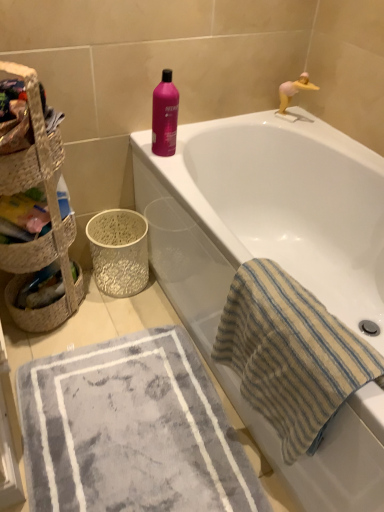
Question: Is white textured basket at lower left, the 2th basket container in the top-to-bottom sequence, facing towards gray plush bath mat at lower left?

Choices:
 (A) yes
 (B) no

Answer: (A)

Question: Considering the relative positions of white textured basket at lower left, acting as the second basket container starting from the front, and gray plush bath mat at lower left in the image provided, is white textured basket at lower left, acting as the second basket container starting from the front, to the right of gray plush bath mat at lower left from the viewer's perspective?

Choices:
 (A) yes
 (B) no

Answer: (B)

Question: Can you confirm if white textured basket at lower left, which appears as the first basket container when ordered from the bottom, is thinner than gray plush bath mat at lower left?

Choices:
 (A) no
 (B) yes

Answer: (B)

Question: Does white textured basket at lower left, which appears as the first basket container when ordered from the bottom, appear on the left side of gray plush bath mat at lower left?

Choices:
 (A) no
 (B) yes

Answer: (B)

Question: Considering the relative sizes of white textured basket at lower left, acting as the second basket container starting from the front, and gray plush bath mat at lower left in the image provided, is white textured basket at lower left, acting as the second basket container starting from the front, wider than gray plush bath mat at lower left?

Choices:
 (A) no
 (B) yes

Answer: (A)

Question: Considering their positions, is woven straw basket at left, positioned as the second basket in bottom-to-top order, located in front of or behind woven straw basket at left, positioned as the first basket container in top-to-bottom order?

Choices:
 (A) behind
 (B) front

Answer: (A)

Question: Considering the positions of woven straw basket at left, arranged as the 1th basket when viewed from the top, and woven straw basket at left, placed as the 2th basket container when sorted from back to front, in the image, is woven straw basket at left, arranged as the 1th basket when viewed from the top, taller or shorter than woven straw basket at left, placed as the 2th basket container when sorted from back to front,?

Choices:
 (A) short
 (B) tall

Answer: (A)

Question: Considering the positions of point (38, 266) and point (26, 68), is point (38, 266) closer or farther from the camera than point (26, 68)?

Choices:
 (A) closer
 (B) farther

Answer: (B)

Question: Is woven straw basket at left, arranged as the 1th basket when viewed from the top, wider or thinner than woven straw basket at left, positioned as the second basket container in bottom-to-top order?

Choices:
 (A) thin
 (B) wide

Answer: (B)

Question: Is pink plastic toy at upper right in front of or behind white textured basket at lower left, the 2th basket container in the top-to-bottom sequence, in the image?

Choices:
 (A) behind
 (B) front

Answer: (A)

Question: Considering the positions of pink plastic toy at upper right and white textured basket at lower left, the 2th basket container in the top-to-bottom sequence, in the image, is pink plastic toy at upper right wider or thinner than white textured basket at lower left, the 2th basket container in the top-to-bottom sequence,?

Choices:
 (A) thin
 (B) wide

Answer: (A)

Question: Is pink plastic toy at upper right taller or shorter than white textured basket at lower left, the 2th basket container in the top-to-bottom sequence?

Choices:
 (A) tall
 (B) short

Answer: (B)

Question: From the image's perspective, is pink plastic toy at upper right positioned above or below white textured basket at lower left, which is the 1th basket container in back-to-front order?

Choices:
 (A) above
 (B) below

Answer: (A)

Question: Considering the positions of pink plastic toy at upper right and woven straw basket at left, arranged as the 1th basket when ordered from the bottom, in the image, is pink plastic toy at upper right bigger or smaller than woven straw basket at left, arranged as the 1th basket when ordered from the bottom,?

Choices:
 (A) small
 (B) big

Answer: (A)

Question: Is pink plastic toy at upper right spatially inside woven straw basket at left, the second basket viewed from the top, or outside of it?

Choices:
 (A) outside
 (B) inside

Answer: (A)